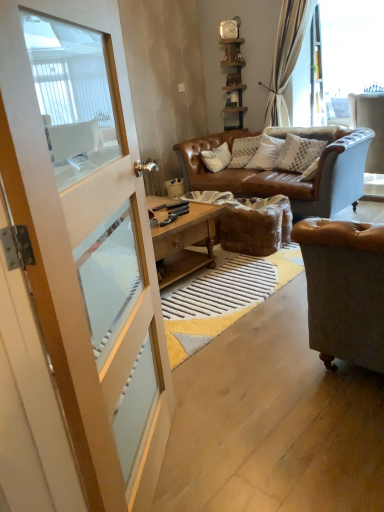
What do you see at coordinates (234, 78) in the screenshot? I see `wooden shelf at upper center` at bounding box center [234, 78].

Describe the element at coordinates (230, 28) in the screenshot. I see `metallic wall clock at upper center` at that location.

Measure the distance between white textured pillow at center and camera.

3.77 meters.

What do you see at coordinates (250, 222) in the screenshot? This screenshot has height=512, width=384. I see `brown leather footrest at center` at bounding box center [250, 222].

The height and width of the screenshot is (512, 384). I want to click on brown leather footrest at center, so click(250, 222).

The height and width of the screenshot is (512, 384). In order to click on wooden shelf at upper center in this screenshot , I will do `click(234, 78)`.

From the image's perspective, is wooden shelf at upper center below white wood screen door at left?

Actually, wooden shelf at upper center appears above white wood screen door at left in the image.

Is white wood screen door at left surrounded by wooden shelf at upper center?

No, white wood screen door at left is located outside of wooden shelf at upper center.

Is wooden shelf at upper center oriented towards white wood screen door at left?

No, wooden shelf at upper center is not aimed at white wood screen door at left.

Is wooden shelf at upper center taller than white wood screen door at left?

No.

Which object is further away from the camera, wooden shelf at upper center or white leather chair at right?

wooden shelf at upper center is further from the camera.

Consider the image. Can you confirm if wooden shelf at upper center is smaller than white leather chair at right?

Correct, wooden shelf at upper center occupies less space than white leather chair at right.

From a real-world perspective, which object rests below the other?

white leather chair at right.

Which object is wider, wooden shelf at upper center or white leather chair at right?

white leather chair at right is wider.

Consider the image. How different are the orientations of wooden shelf at upper center and brown leather footrest at center in degrees?

2.92 degrees separate the facing orientations of wooden shelf at upper center and brown leather footrest at center.

Consider the image. Who is bigger, wooden shelf at upper center or brown leather footrest at center?

brown leather footrest at center is bigger.

In the image, is wooden shelf at upper center on the left side or the right side of brown leather footrest at center?

In the image, wooden shelf at upper center appears on the left side of brown leather footrest at center.

Does metallic wall clock at upper center contain white wood screen door at left?

No, metallic wall clock at upper center does not contain white wood screen door at left.

You are a GUI agent. You are given a task and a screenshot of the screen. Output one action in this format:
    pyautogui.click(x=<x>, y=<y>)
    Task: Click on the screen door below the metallic wall clock at upper center (from a real-world perspective)
    This screenshot has width=384, height=512.
    Given the screenshot: What is the action you would take?
    pyautogui.click(x=77, y=274)

In the scene shown: What's the angular difference between metallic wall clock at upper center and white wood screen door at left's facing directions?

83.9 degrees.

Between metallic wall clock at upper center and white wood screen door at left, which one appears on the left side from the viewer's perspective?

white wood screen door at left.

Can you confirm if white textured pillow at center is taller than transparent glass window at upper right?

In fact, white textured pillow at center may be shorter than transparent glass window at upper right.

Considering the sizes of objects white textured pillow at center and transparent glass window at upper right in the image provided, who is smaller, white textured pillow at center or transparent glass window at upper right?

With smaller size is white textured pillow at center.

Would you say white textured pillow at center is outside transparent glass window at upper right?

That's correct, white textured pillow at center is outside of transparent glass window at upper right.

In the image, is white textured pillow at center positioned in front of or behind transparent glass window at upper right?

Clearly, white textured pillow at center is in front of transparent glass window at upper right.

How many degrees apart are the facing directions of white textured pillow at center and white leather chair at right?

The facing directions of white textured pillow at center and white leather chair at right are 171 degrees apart.

In the image, is white textured pillow at center positioned in front of or behind white leather chair at right?

Visually, white textured pillow at center is located in front of white leather chair at right.

From the image's perspective, which one is positioned lower, white textured pillow at center or white leather chair at right?

white textured pillow at center.

In the scene shown: Can you confirm if white textured pillow at center is wider than white leather chair at right?

No, white textured pillow at center is not wider than white leather chair at right.

Considering the points (257, 207) and (15, 187), which point is behind, point (257, 207) or point (15, 187)?

The point (257, 207) is more distant.

You are a GUI agent. You are given a task and a screenshot of the screen. Output one action in this format:
    pyautogui.click(x=<x>, y=<y>)
    Task: Click on the screen door that appears above the brown leather footrest at center (from a real-world perspective)
    
    Given the screenshot: What is the action you would take?
    pyautogui.click(x=77, y=274)

Relative to white wood screen door at left, is brown leather footrest at center in front or behind?

brown leather footrest at center is positioned farther from the viewer than white wood screen door at left.

Can you confirm if brown leather footrest at center is smaller than white wood screen door at left?

Indeed, brown leather footrest at center has a smaller size compared to white wood screen door at left.

Find the location of `screen door that is on the left side of wooden shelf at upper center`. screen door that is on the left side of wooden shelf at upper center is located at coordinates point(77,274).

I want to click on chair in front of the wooden shelf at upper center, so click(x=370, y=125).

Consider the image. Estimate the real-world distances between objects in this image. Which object is closer to white wood screen door at left, wooden shelf at upper center or white leather chair at right?

white leather chair at right is positioned closer to the anchor white wood screen door at left.

Considering their positions, is white leather chair at right positioned closer to wooden shelf at upper center than brown leather footrest at center?

white leather chair at right lies closer to wooden shelf at upper center than the other object.

Estimate the real-world distances between objects in this image. Which object is further from wooden shelf at upper center, white textured pillow at center or white wood screen door at left?

Based on the image, white wood screen door at left appears to be further to wooden shelf at upper center.

Based on their spatial positions, is white wood screen door at left or white leather chair at right further from transparent glass window at upper right?

Among the two, white wood screen door at left is located further to transparent glass window at upper right.

Which object lies further to the anchor point white wood screen door at left, brown leather footrest at center or metallic wall clock at upper center?

The object further to white wood screen door at left is metallic wall clock at upper center.

Looking at the image, which one is located closer to white textured pillow at center, white leather chair at right or wooden shelf at upper center?

white leather chair at right.

Considering their positions, is metallic wall clock at upper center positioned further to white wood screen door at left than wooden shelf at upper center?

Among the two, metallic wall clock at upper center is located further to white wood screen door at left.

From the image, which object appears to be farther from white wood screen door at left, white leather chair at right or transparent glass window at upper right?

transparent glass window at upper right.

The width and height of the screenshot is (384, 512). I want to click on clock between wooden shelf at upper center and transparent glass window at upper right from front to back, so click(x=230, y=28).

I want to click on shelf positioned between brown leather footrest at center and transparent glass window at upper right from near to far, so pyautogui.click(x=234, y=78).

Find the location of a particular element. chair between brown leather footrest at center and transparent glass window at upper right from front to back is located at coordinates (370, 125).

Find the location of a particular element. This screenshot has height=512, width=384. clock between white leather chair at right and transparent glass window at upper right from front to back is located at coordinates (230, 28).